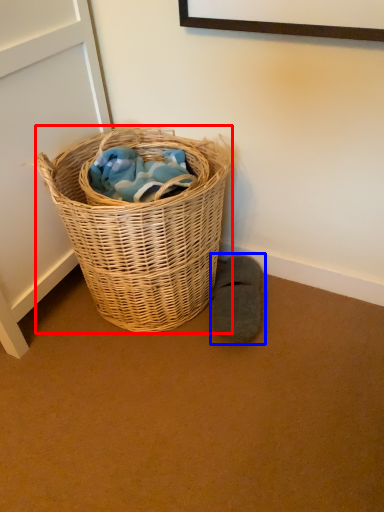
Question: Among these objects, which one is nearest to the camera, picnic basket (highlighted by a red box) or footwear (highlighted by a blue box)?

Choices:
 (A) picnic basket
 (B) footwear

Answer: (A)